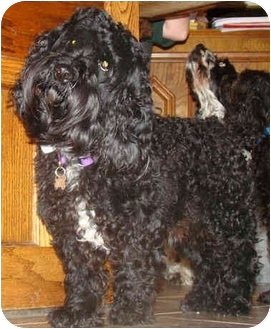
The height and width of the screenshot is (329, 271). I want to click on floor, so click(x=171, y=318), click(x=258, y=313), click(x=34, y=322).